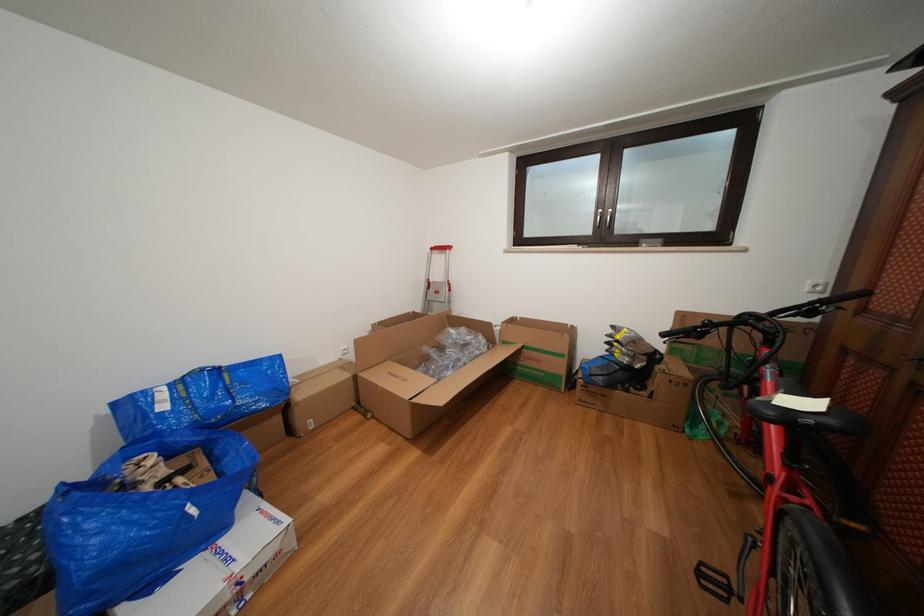
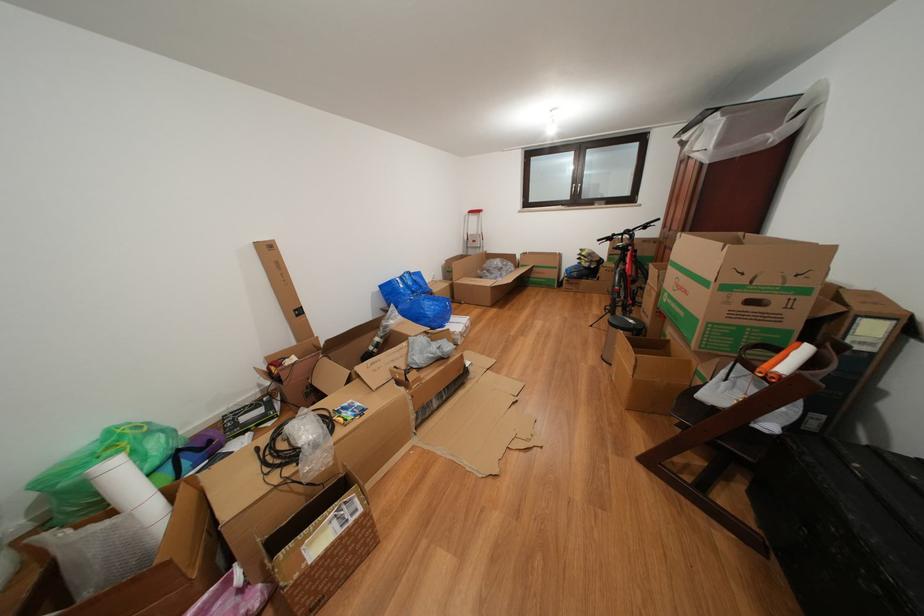
In the second image, find the point that corresponds to (172,411) in the first image.

(409, 291)